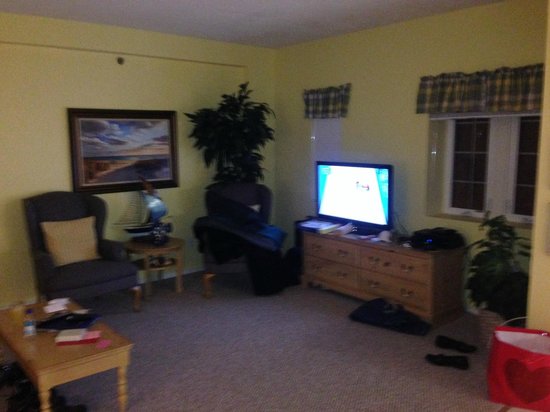
Locate an element on the screen. The height and width of the screenshot is (412, 550). window is located at coordinates (478, 157), (524, 157).